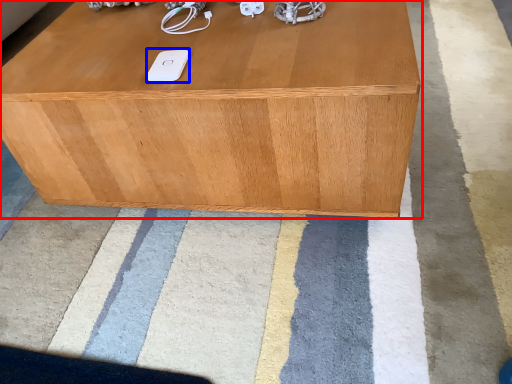
Question: Which point is further to the camera, table (highlighted by a red box) or ipod (highlighted by a blue box)?

Choices:
 (A) table
 (B) ipod

Answer: (B)